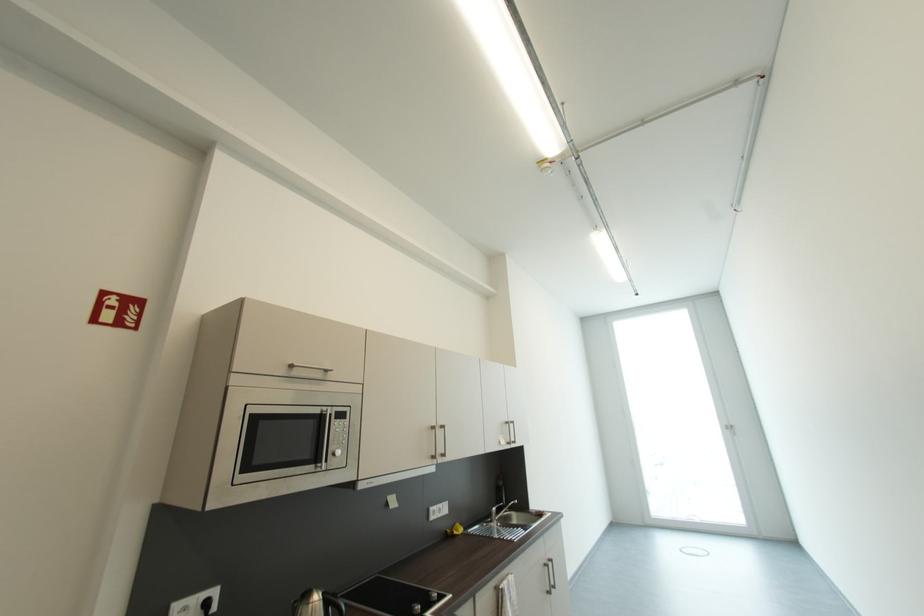
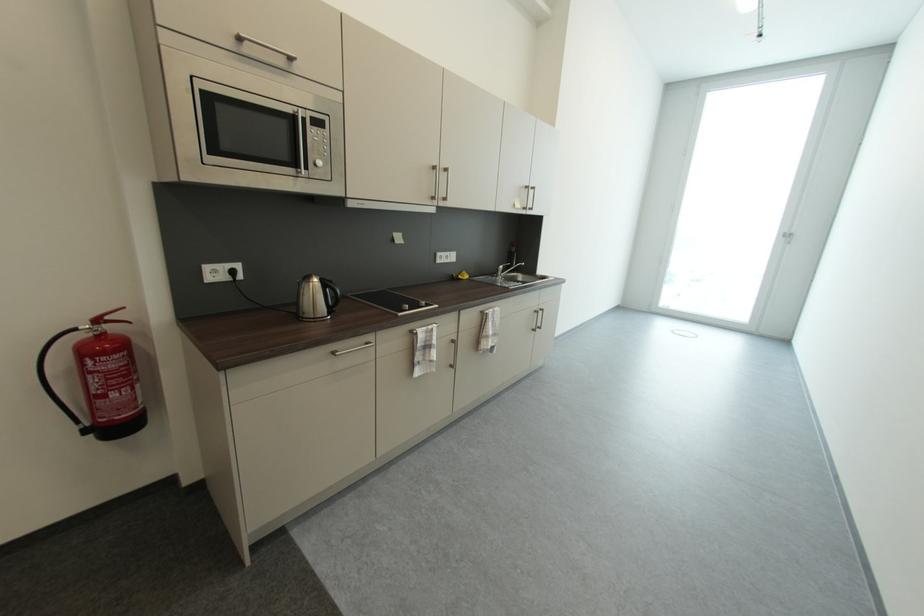
In the second image, find the point that corresponds to pixel 495 522 in the first image.

(502, 277)